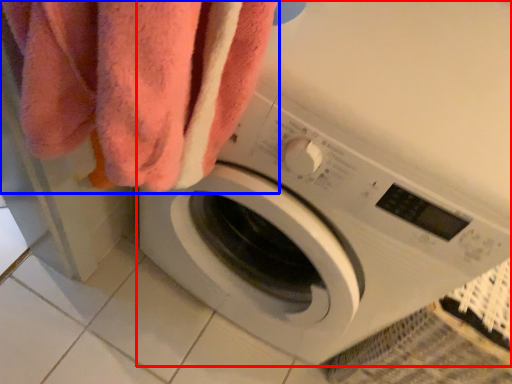
Question: Which of the following is the farthest to the observer, washing machine (highlighted by a red box) or towel (highlighted by a blue box)?

Choices:
 (A) washing machine
 (B) towel

Answer: (B)